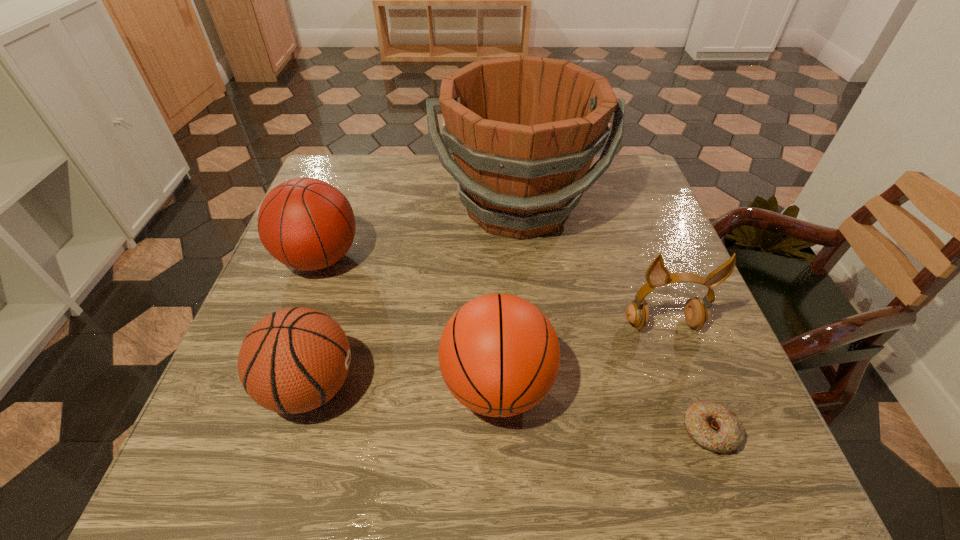
At what (x,y) coordinates should I click in order to perform the action: click on the tallest object. Please return your answer as a coordinate pair (x, y). This screenshot has width=960, height=540. Looking at the image, I should click on (524, 130).

Where is `the farthest basketball`? The width and height of the screenshot is (960, 540). the farthest basketball is located at coordinates (307, 224).

Find the location of a particular element. The height and width of the screenshot is (540, 960). earphone is located at coordinates click(x=696, y=314).

Where is `the rightmost basketball`? Image resolution: width=960 pixels, height=540 pixels. the rightmost basketball is located at coordinates (499, 355).

What are the coordinates of `doughnut` in the screenshot? It's located at (715, 427).

Find the location of a particular element. The image size is (960, 540). vacant space situated on the handle side of the bucket is located at coordinates (525, 277).

You are a GUI agent. You are given a task and a screenshot of the screen. Output one action in this format:
    pyautogui.click(x=<x>, y=<y>)
    Task: Click on the vacant area situated 0.310m on the front of the farthest basketball
    
    Given the screenshot: What is the action you would take?
    pyautogui.click(x=260, y=423)

Where is `vacant space located on the front-facing side of the third farthest object`? This screenshot has width=960, height=540. vacant space located on the front-facing side of the third farthest object is located at coordinates (715, 469).

At what (x,y) coordinates should I click in order to perform the action: click on vacant area situated 0.080m on the right of the rightmost basketball. Please return your answer as a coordinate pair (x, y). The height and width of the screenshot is (540, 960). Looking at the image, I should click on (596, 386).

You are a GUI agent. You are given a task and a screenshot of the screen. Output one action in this format:
    pyautogui.click(x=<x>, y=<y>)
    Task: Click on the blank space located 0.060m on the back of the shortest object
    
    Given the screenshot: What is the action you would take?
    pyautogui.click(x=689, y=377)